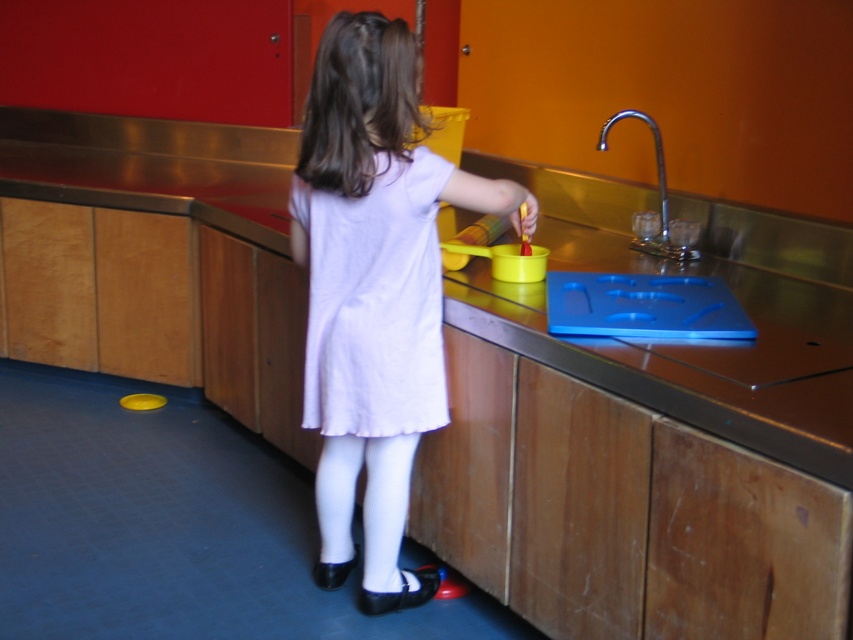
Is white matte dress at center further to camera compared to white cotton dress at center?

No, white matte dress at center is in front of white cotton dress at center.

Identify the location of white matte dress at center. (374, 292).

Can you confirm if white matte dress at center is wider than silver metallic faucet at upper right?

Yes, white matte dress at center is wider than silver metallic faucet at upper right.

Between white matte dress at center and silver metallic faucet at upper right, which one is positioned higher?

silver metallic faucet at upper right is above.

Who is more distant from viewer, (418, 394) or (601, 129)?

The point (601, 129) is more distant.

This screenshot has width=853, height=640. Find the location of `white matte dress at center`. white matte dress at center is located at coordinates (374, 292).

Does white cotton dress at center appear on the left side of silver metallic faucet at upper right?

Indeed, white cotton dress at center is positioned on the left side of silver metallic faucet at upper right.

Consider the image. Can you confirm if white cotton dress at center is positioned below silver metallic faucet at upper right?

Indeed, white cotton dress at center is positioned under silver metallic faucet at upper right.

Does point (364, 429) come behind point (618, 116)?

No, (364, 429) is in front of (618, 116).

I want to click on white cotton dress at center, so click(x=375, y=301).